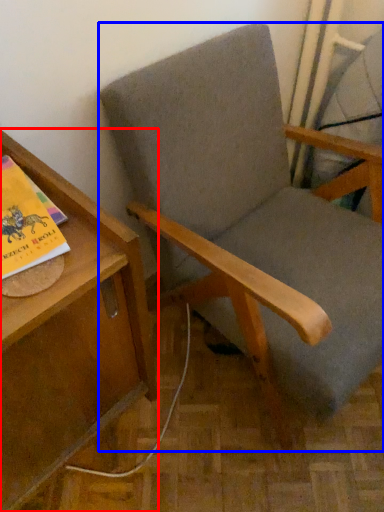
Question: Which object appears closest to the camera in this image, table (highlighted by a red box) or chair (highlighted by a blue box)?

Choices:
 (A) table
 (B) chair

Answer: (A)